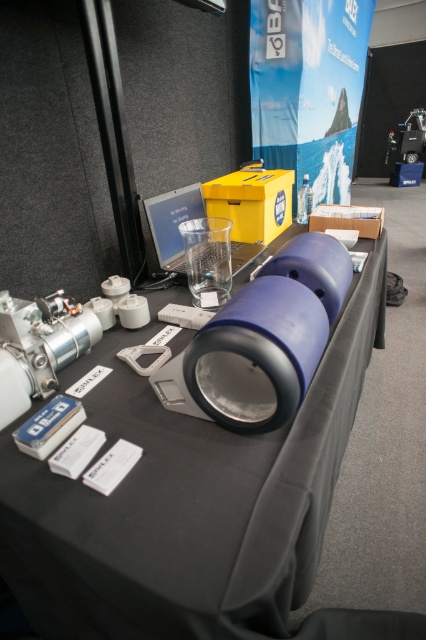
Question: Considering the relative positions of blue plastic cylinder at center and clear plastic bottle at center in the image provided, where is blue plastic cylinder at center located with respect to clear plastic bottle at center?

Choices:
 (A) below
 (B) above

Answer: (A)

Question: Is blue plastic cylinder at center below clear plastic bottle at center?

Choices:
 (A) no
 (B) yes

Answer: (B)

Question: Is blue plastic cylinder at center behind clear plastic bottle at center?

Choices:
 (A) no
 (B) yes

Answer: (A)

Question: Which point is closer to the camera taking this photo?

Choices:
 (A) (301, 218)
 (B) (8, 449)

Answer: (B)